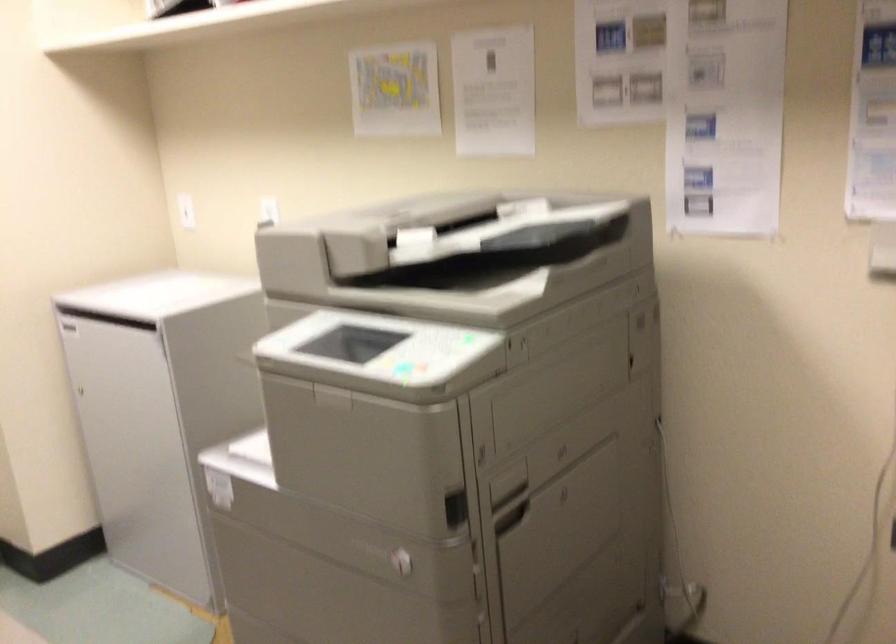
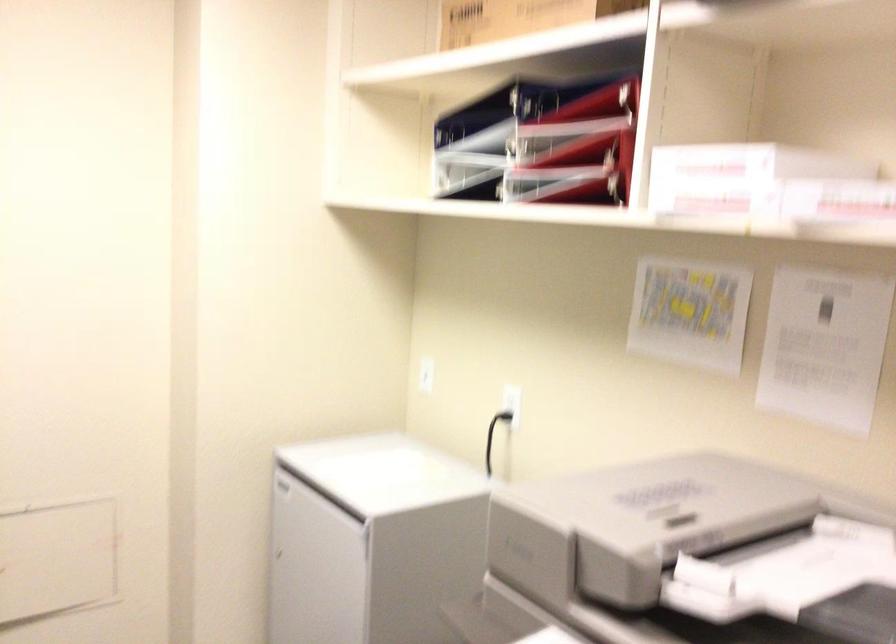
The point at (142, 285) is marked in the first image. Where is the corresponding point in the second image?

(359, 456)